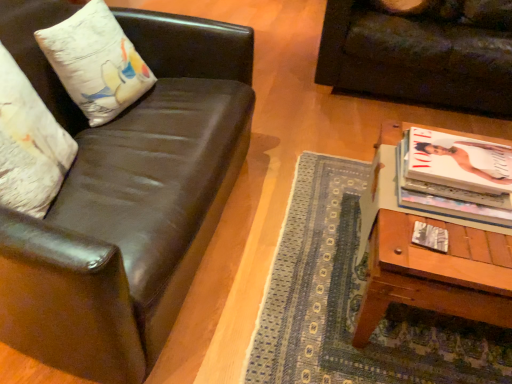
The height and width of the screenshot is (384, 512). Describe the element at coordinates (29, 144) in the screenshot. I see `white textured pillow at left, acting as the 1th pillow starting from the front` at that location.

Describe the element at coordinates (435, 273) in the screenshot. I see `wooden table at lower right` at that location.

Measure the distance between shiny black leather couch at left, acting as the 2th studio couch starting from the back, and camera.

shiny black leather couch at left, acting as the 2th studio couch starting from the back, and camera are 29.26 inches apart.

The width and height of the screenshot is (512, 384). I want to click on white textured pillow at left, the second pillow from the back, so click(x=29, y=144).

Is white textured pillow at left, acting as the 1th pillow starting from the front, positioned far away from shiny black leather couch at left, which ranks as the 1th studio couch in left-to-right order?

Actually, white textured pillow at left, acting as the 1th pillow starting from the front, and shiny black leather couch at left, which ranks as the 1th studio couch in left-to-right order, are a little close together.

How far apart are white textured pillow at left, acting as the 1th pillow starting from the front, and shiny black leather couch at left, acting as the 2th studio couch starting from the back?

white textured pillow at left, acting as the 1th pillow starting from the front, is 10.27 inches away from shiny black leather couch at left, acting as the 2th studio couch starting from the back.

Do you think white textured pillow at left, the second pillow from the back, is within shiny black leather couch at left, which ranks as the 1th studio couch in left-to-right order, or outside of it?

white textured pillow at left, the second pillow from the back, is enclosed within shiny black leather couch at left, which ranks as the 1th studio couch in left-to-right order.

Between white textured pillow at left, acting as the 1th pillow starting from the front, and shiny black leather couch at left, which is the 1th studio couch from front to back, which one appears on the right side from the viewer's perspective?

Positioned to the right is shiny black leather couch at left, which is the 1th studio couch from front to back.

Consider the image. In terms of width, does white cotton pillow at upper left, which is the 2th pillow in front-to-back order, look wider or thinner when compared to matte white magazine at right?

Considering their sizes, white cotton pillow at upper left, which is the 2th pillow in front-to-back order, looks broader than matte white magazine at right.

Who is bigger, white cotton pillow at upper left, which is the 2th pillow in front-to-back order, or matte white magazine at right?

Bigger between the two is white cotton pillow at upper left, which is the 2th pillow in front-to-back order.

Which is more to the right, white cotton pillow at upper left, the first pillow positioned from the back, or matte white magazine at right?

Positioned to the right is matte white magazine at right.

From the image's perspective, is shiny black leather couch at left, acting as the 2th studio couch starting from the back, located above or below white cotton pillow at upper left, the first pillow positioned from the back?

From the image's perspective, shiny black leather couch at left, acting as the 2th studio couch starting from the back, appears below white cotton pillow at upper left, the first pillow positioned from the back.

Is the surface of shiny black leather couch at left, which is the 1th studio couch from front to back, in direct contact with white cotton pillow at upper left, which is the 2th pillow in front-to-back order?

There is a gap between shiny black leather couch at left, which is the 1th studio couch from front to back, and white cotton pillow at upper left, which is the 2th pillow in front-to-back order.

Is shiny black leather couch at left, arranged as the second studio couch when viewed from the right, facing towards white cotton pillow at upper left, the first pillow positioned from the back?

Yes, shiny black leather couch at left, arranged as the second studio couch when viewed from the right, is facing white cotton pillow at upper left, the first pillow positioned from the back.

Is point (223, 179) positioned behind point (67, 92)?

Yes, point (223, 179) is farther from viewer.

Is matte white magazine at right bigger than white cotton pillow at upper left, which is the 2th pillow in front-to-back order?

No.

The width and height of the screenshot is (512, 384). In order to click on magazine that is on the right side of white cotton pillow at upper left, which is the 2th pillow in front-to-back order in this screenshot , I will do `click(430, 237)`.

Based on the photo, is matte white magazine at right turned away from white cotton pillow at upper left, the first pillow positioned from the back?

No, matte white magazine at right's orientation is not away from white cotton pillow at upper left, the first pillow positioned from the back.

In the image, is white cotton pillow at upper left, the first pillow positioned from the back, positioned in front of or behind white textured pillow at left, acting as the 1th pillow starting from the front?

white cotton pillow at upper left, the first pillow positioned from the back, is behind white textured pillow at left, acting as the 1th pillow starting from the front.

Can you confirm if white cotton pillow at upper left, the first pillow positioned from the back, is positioned to the left of white textured pillow at left, the second pillow from the back?

Incorrect, white cotton pillow at upper left, the first pillow positioned from the back, is not on the left side of white textured pillow at left, the second pillow from the back.

Is the surface of white cotton pillow at upper left, which is the 2th pillow in front-to-back order, in direct contact with white textured pillow at left, acting as the 1th pillow starting from the front?

No, white cotton pillow at upper left, which is the 2th pillow in front-to-back order, is not in contact with white textured pillow at left, acting as the 1th pillow starting from the front.

From the image's perspective, which object appears higher, white cotton pillow at upper left, which is the 2th pillow in front-to-back order, or white textured pillow at left, acting as the 1th pillow starting from the front?

white cotton pillow at upper left, which is the 2th pillow in front-to-back order, from the image's perspective.

Who is shorter, white cotton pillow at upper left, which is the 2th pillow in front-to-back order, or shiny black leather couch at left, which is the 1th studio couch from front to back?

white cotton pillow at upper left, which is the 2th pillow in front-to-back order, is shorter.

Does white cotton pillow at upper left, which is the 2th pillow in front-to-back order, lie behind shiny black leather couch at left, arranged as the second studio couch when viewed from the right?

That is True.

Considering the sizes of objects white cotton pillow at upper left, the first pillow positioned from the back, and shiny black leather couch at left, acting as the 2th studio couch starting from the back, in the image provided, who is smaller, white cotton pillow at upper left, the first pillow positioned from the back, or shiny black leather couch at left, acting as the 2th studio couch starting from the back,?

With smaller size is white cotton pillow at upper left, the first pillow positioned from the back.

Is white cotton pillow at upper left, the first pillow positioned from the back, aimed at shiny black leather couch at left, acting as the 2th studio couch starting from the back?

Yes, white cotton pillow at upper left, the first pillow positioned from the back, is facing shiny black leather couch at left, acting as the 2th studio couch starting from the back.

Is dark brown leather couch at upper right, the 1th studio couch in the right-to-left sequence, looking in the opposite direction of white glossy magazine at right?

No, white glossy magazine at right is not at the back of dark brown leather couch at upper right, the 1th studio couch in the right-to-left sequence.

Between dark brown leather couch at upper right, which is counted as the 2th studio couch, starting from the left, and white glossy magazine at right, which one has smaller size?

white glossy magazine at right is smaller.

Does dark brown leather couch at upper right, the 1th studio couch in the right-to-left sequence, have a greater width compared to white glossy magazine at right?

Indeed, dark brown leather couch at upper right, the 1th studio couch in the right-to-left sequence, has a greater width compared to white glossy magazine at right.

Is dark brown leather couch at upper right, the 1th studio couch in the right-to-left sequence, spatially inside white glossy magazine at right, or outside of it?

The correct answer is: outside.

At what (x,y) coordinates should I click in order to perform the action: click on the 2nd pillow directly above the shiny black leather couch at left, arranged as the second studio couch when viewed from the right (from a real-world perspective). Please return your answer as a coordinate pair (x, y). The image size is (512, 384). Looking at the image, I should click on (29, 144).

You are a GUI agent. You are given a task and a screenshot of the screen. Output one action in this format:
    pyautogui.click(x=<x>, y=<y>)
    Task: Click on the pillow behind the matte white magazine at right
    The height and width of the screenshot is (384, 512).
    Given the screenshot: What is the action you would take?
    pyautogui.click(x=96, y=62)

Looking at the image, which one is located further to white cotton pillow at upper left, the first pillow positioned from the back, white glossy magazine at right or matte white magazine at right?

matte white magazine at right lies further to white cotton pillow at upper left, the first pillow positioned from the back, than the other object.

Estimate the real-world distances between objects in this image. Which object is further from white textured pillow at left, the second pillow from the back, shiny black leather couch at left, acting as the 2th studio couch starting from the back, or wooden table at lower right?

wooden table at lower right is further to white textured pillow at left, the second pillow from the back.

Considering their positions, is dark brown leather couch at upper right, arranged as the 1th studio couch when viewed from the back, positioned closer to white textured pillow at left, acting as the 1th pillow starting from the front, than wooden table at lower right?

wooden table at lower right is closer to white textured pillow at left, acting as the 1th pillow starting from the front.

Estimate the real-world distances between objects in this image. Which object is closer to wooden table at lower right, white cotton pillow at upper left, the first pillow positioned from the back, or white textured pillow at left, acting as the 1th pillow starting from the front?

white textured pillow at left, acting as the 1th pillow starting from the front, is closer to wooden table at lower right.

Based on the photo, when comparing their distances from wooden table at lower right, does matte white magazine at right or white cotton pillow at upper left, the first pillow positioned from the back, seem closer?

The object closer to wooden table at lower right is matte white magazine at right.

Considering their positions, is shiny black leather couch at left, which is the 1th studio couch from front to back, positioned closer to matte white magazine at right than wooden table at lower right?

wooden table at lower right is positioned closer to the anchor matte white magazine at right.

Which object lies nearer to the anchor point white textured pillow at left, acting as the 1th pillow starting from the front, white cotton pillow at upper left, which is the 2th pillow in front-to-back order, or dark brown leather couch at upper right, the 1th studio couch in the right-to-left sequence?

Based on the image, white cotton pillow at upper left, which is the 2th pillow in front-to-back order, appears to be nearer to white textured pillow at left, acting as the 1th pillow starting from the front.

When comparing their distances from white glossy magazine at right, does shiny black leather couch at left, which is the 1th studio couch from front to back, or dark brown leather couch at upper right, the 2th studio couch positioned from the front, seem further?

Based on the image, dark brown leather couch at upper right, the 2th studio couch positioned from the front, appears to be further to white glossy magazine at right.

You are a GUI agent. You are given a task and a screenshot of the screen. Output one action in this format:
    pyautogui.click(x=<x>, y=<y>)
    Task: Click on the magazine between dark brown leather couch at upper right, the 1th studio couch in the right-to-left sequence, and wooden table at lower right in the up-down direction
    The width and height of the screenshot is (512, 384).
    Given the screenshot: What is the action you would take?
    pyautogui.click(x=430, y=237)

The height and width of the screenshot is (384, 512). In order to click on magazine between white textured pillow at left, acting as the 1th pillow starting from the front, and white glossy magazine at right, in the horizontal direction in this screenshot , I will do `click(430, 237)`.

Locate an element on the screen. The image size is (512, 384). paperback book between white textured pillow at left, the second pillow from the back, and wooden table at lower right from left to right is located at coordinates (452, 196).

In order to click on magazine between white cotton pillow at upper left, the first pillow positioned from the back, and white glossy magazine at right from left to right in this screenshot , I will do `click(430, 237)`.